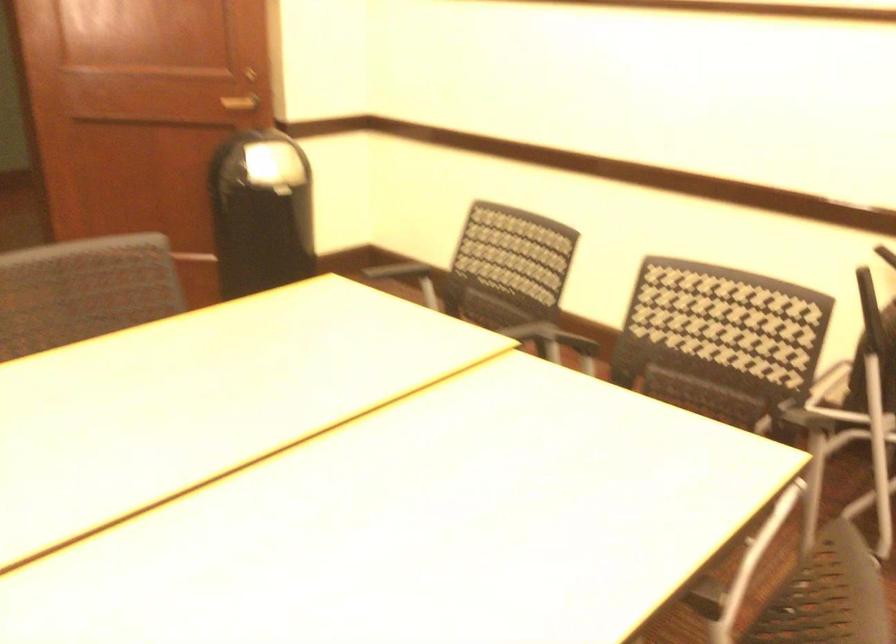
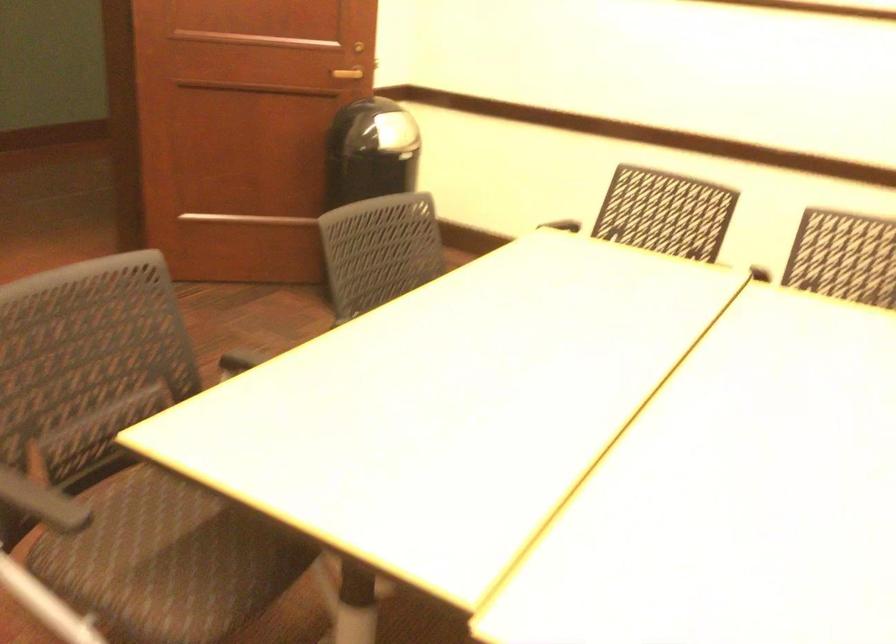
Question: The camera is either moving clockwise (left) or counter-clockwise (right) around the object. The first image is from the beginning of the video and the second image is from the end. Is the camera moving left or right when shooting the video?

Choices:
 (A) Left
 (B) Right

Answer: (A)